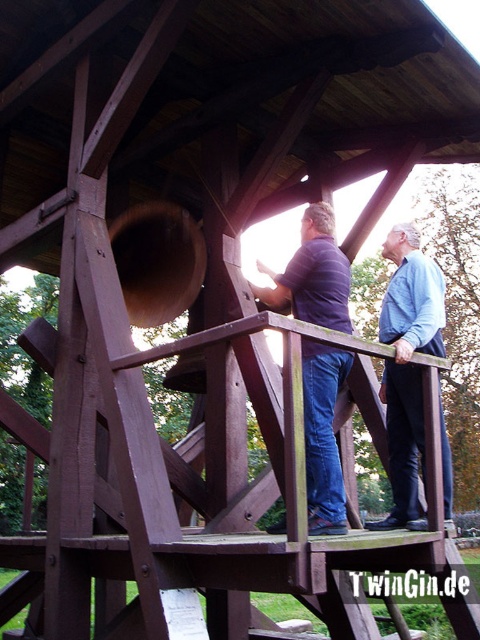
Question: Among these points, which one is farthest from the camera?

Choices:
 (A) (410, 317)
 (B) (323, 508)

Answer: (A)

Question: Does matte blue shirt at center appear under blue denim jeans at upper center?

Choices:
 (A) yes
 (B) no

Answer: (B)

Question: From the image, what is the correct spatial relationship of matte blue shirt at center in relation to blue denim jeans at upper center?

Choices:
 (A) below
 (B) above

Answer: (B)

Question: Which point appears farthest from the camera in this image?

Choices:
 (A) (337, 365)
 (B) (409, 520)

Answer: (B)

Question: Does matte blue shirt at center have a greater width compared to blue denim jeans at upper center?

Choices:
 (A) no
 (B) yes

Answer: (B)